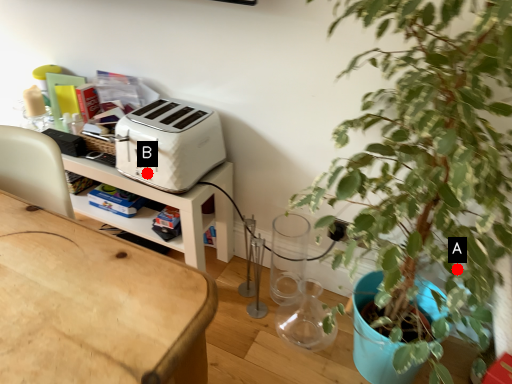
Question: Two points are circled on the image, labeled by A and B beside each circle. Which point is closer to the camera taking this photo?

Choices:
 (A) A is closer
 (B) B is closer

Answer: (A)